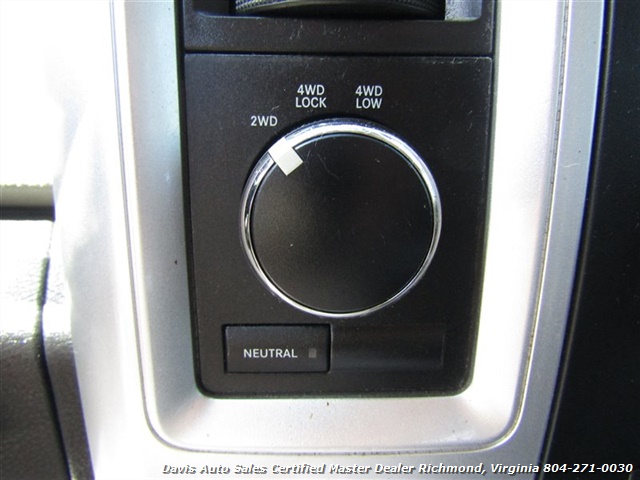
Locate an element on the screen. silver circle around knob is located at coordinates (362, 312).